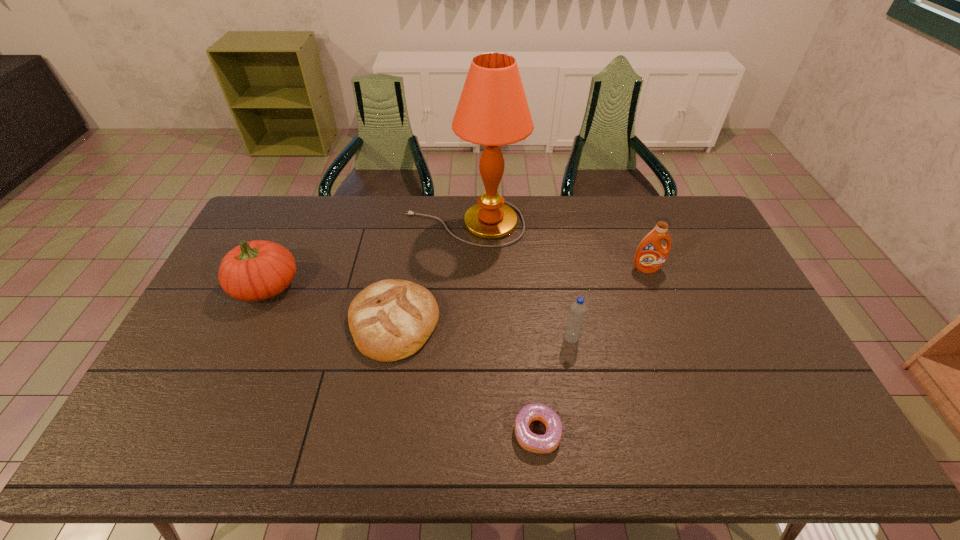
The image size is (960, 540). I want to click on free space located on the front of the leftmost object, so click(x=235, y=353).

At what (x,y) coordinates should I click in order to perform the action: click on blank area located on the right of the water bottle. Please return your answer as a coordinate pair (x, y). The width and height of the screenshot is (960, 540). Looking at the image, I should click on (648, 338).

Find the location of `vacant area situated on the right of the bread`. vacant area situated on the right of the bread is located at coordinates (483, 322).

Locate an element on the screen. This screenshot has width=960, height=540. free spot located on the left of the shortest object is located at coordinates (396, 433).

Where is `object that is at the far edge`? The image size is (960, 540). object that is at the far edge is located at coordinates (493, 111).

The image size is (960, 540). What are the coordinates of `object located at the near edge` in the screenshot? It's located at (547, 443).

Image resolution: width=960 pixels, height=540 pixels. I want to click on object that is at the left edge, so click(257, 270).

This screenshot has width=960, height=540. In the image, there is a desktop. Identify the location of vacant space at the far edge. (625, 225).

The height and width of the screenshot is (540, 960). What are the coordinates of `free region at the near edge` in the screenshot? It's located at (344, 449).

You are a GUI agent. You are given a task and a screenshot of the screen. Output one action in this format:
    pyautogui.click(x=<x>, y=<y>)
    Task: Click on the free space at the left edge of the desktop
    Image resolution: width=960 pixels, height=540 pixels.
    Given the screenshot: What is the action you would take?
    pyautogui.click(x=213, y=309)